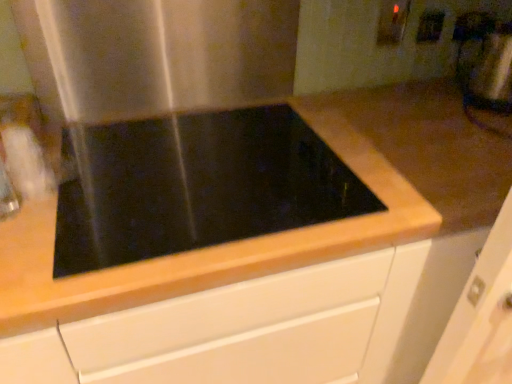
What are the coordinates of `vacant area to the right of stainless steel at upper left` in the screenshot? It's located at (319, 126).